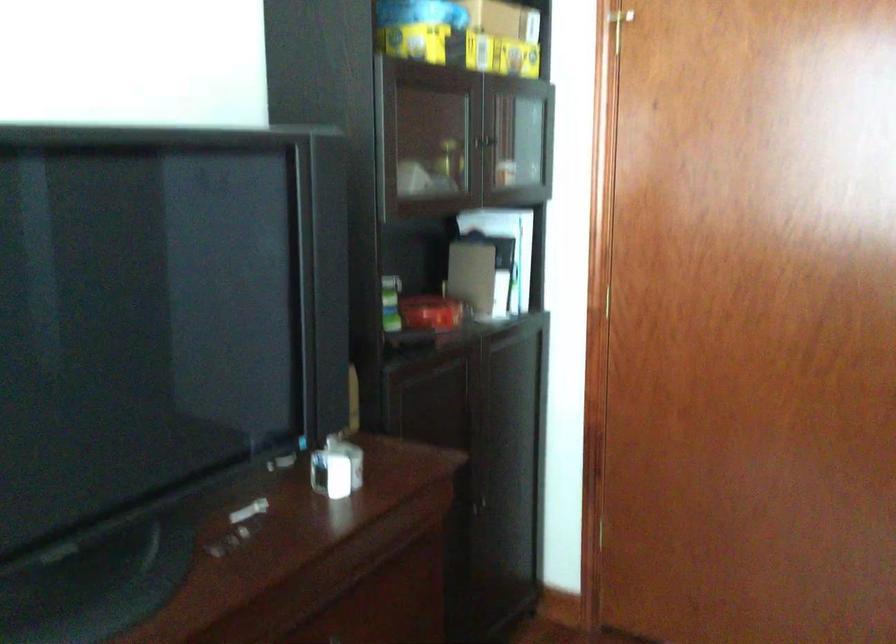
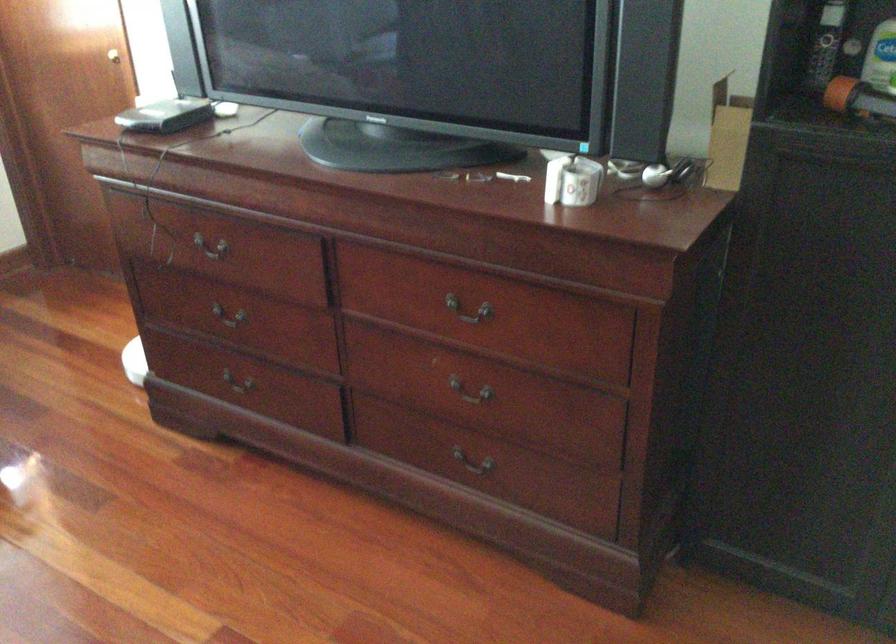
The point at [333,468] is marked in the first image. Where is the corresponding point in the second image?

(572, 180)